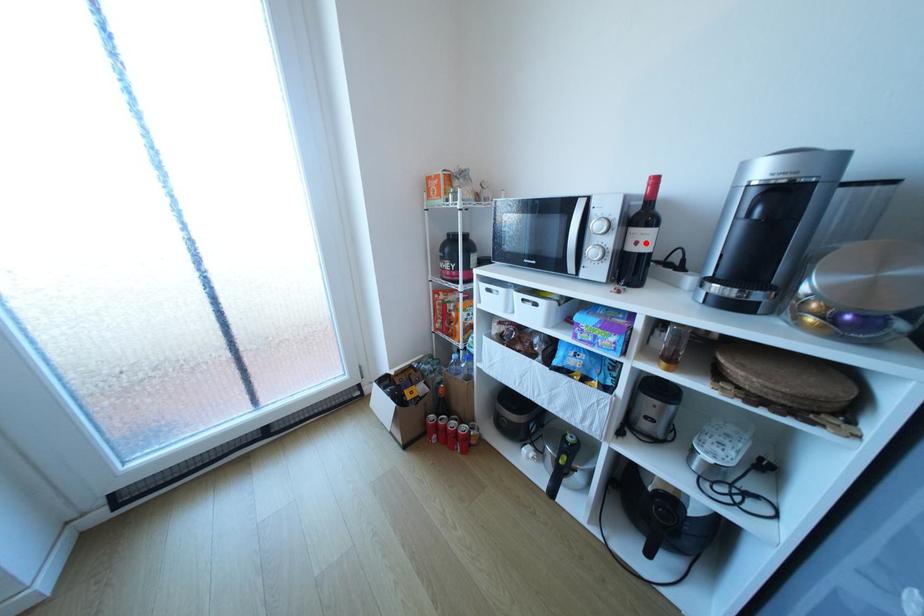
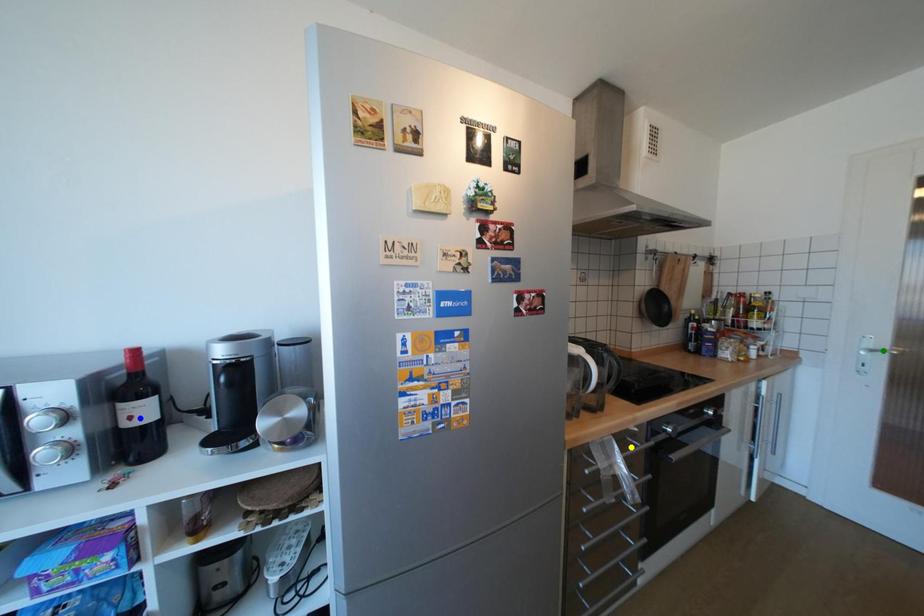
Question: I am providing you with two images of the same scene from different viewpoints. A red point is marked on the first image. You are given multiple points on the second image. Which point in image 2 is actually the same real-world point as the red point in image 1?

Choices:
 (A) blue point
 (B) green point
 (C) yellow point

Answer: (A)